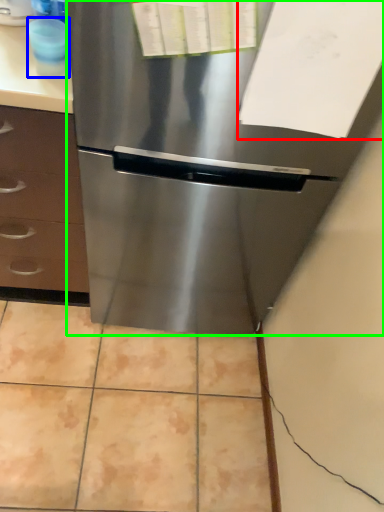
Question: Which object is positioned farthest from paper (highlighted by a red box)? Select from appliance (highlighted by a blue box) and refrigerator (highlighted by a green box).

Choices:
 (A) appliance
 (B) refrigerator

Answer: (A)